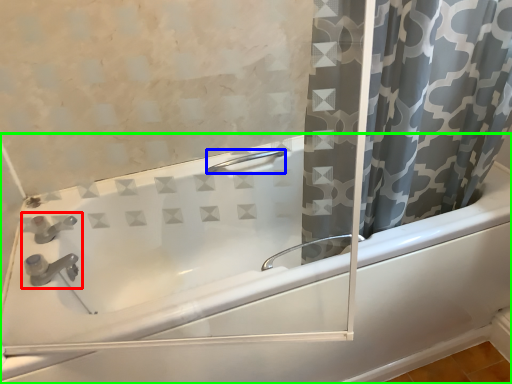
Question: Estimate the real-world distances between objects in this image. Which object is farther from sink (highlighted by a red box), shower (highlighted by a blue box) or bathtub (highlighted by a green box)?

Choices:
 (A) shower
 (B) bathtub

Answer: (A)